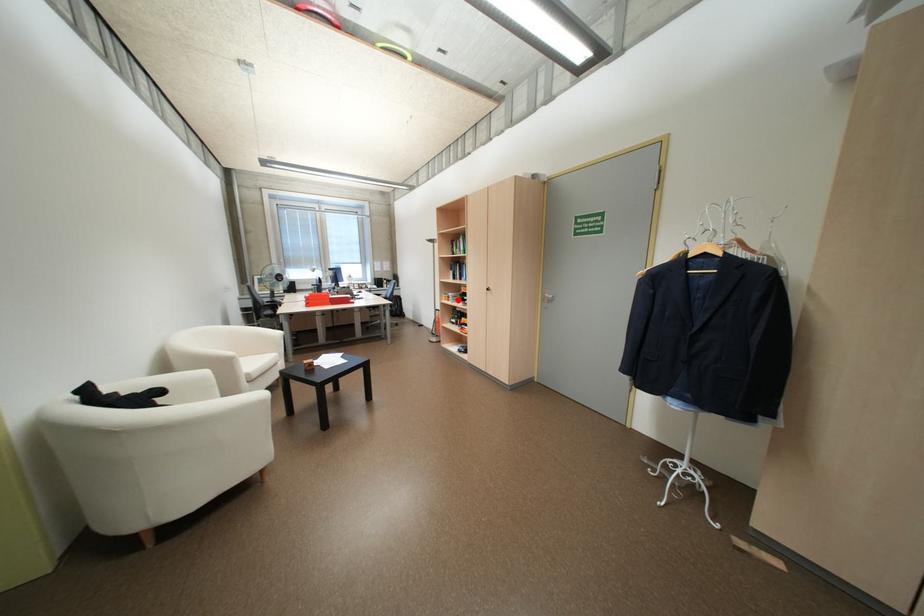
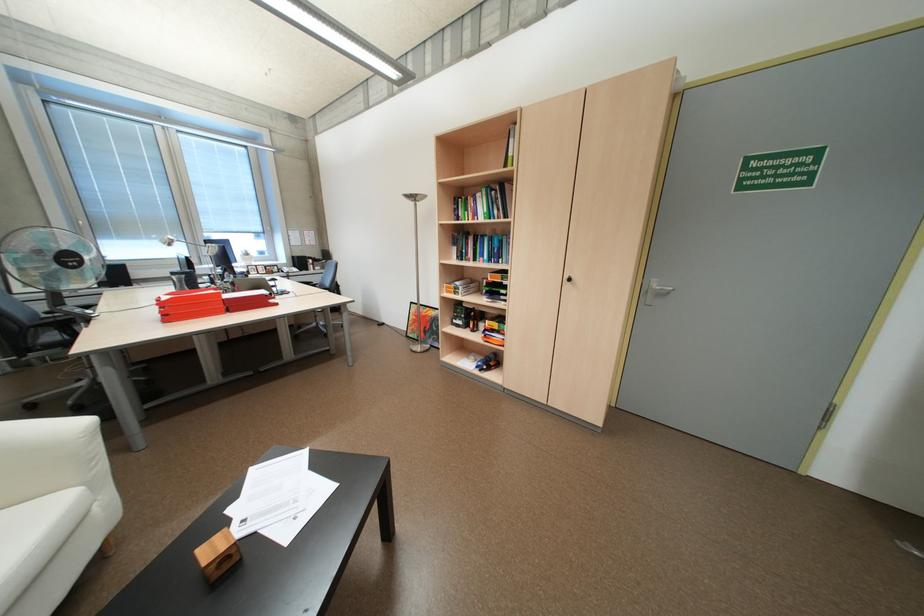
In the second image, find the point that corresponds to the highlighted location in the first image.

(465, 293)